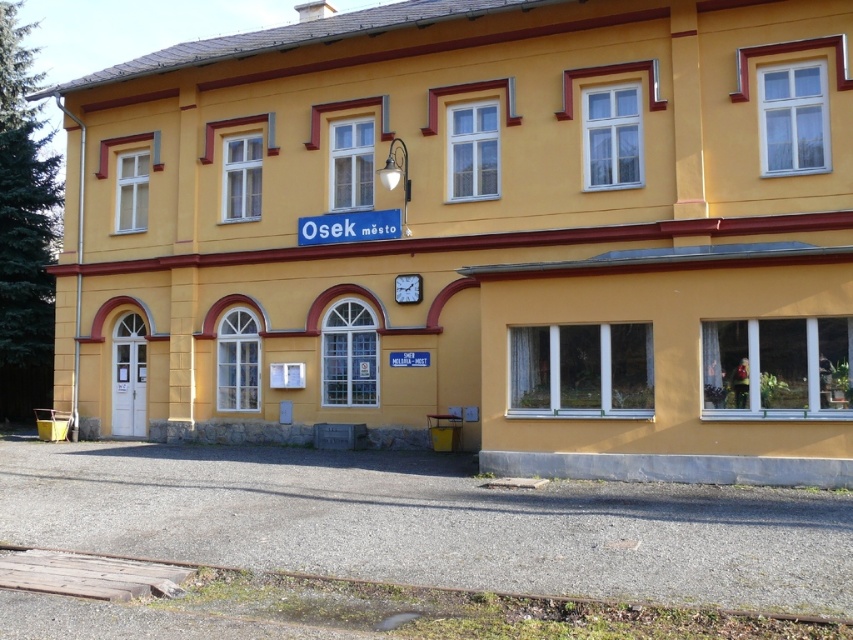
Question: Is matte yellow building at center behind white plastic window at center?

Choices:
 (A) no
 (B) yes

Answer: (A)

Question: Can you confirm if matte yellow building at center is thinner than white plastic window at center?

Choices:
 (A) yes
 (B) no

Answer: (B)

Question: Which point is farther to the camera?

Choices:
 (A) tap(695, 449)
 (B) tap(500, 340)

Answer: (B)

Question: Is matte yellow building at center above white plastic window at center?

Choices:
 (A) yes
 (B) no

Answer: (A)

Question: Among these points, which one is farthest from the camera?

Choices:
 (A) (677, 188)
 (B) (503, 276)

Answer: (A)